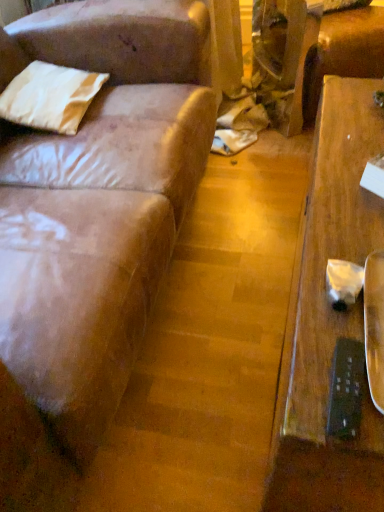
Question: Should I look upward or downward to see white cotton pillow at upper left?

Choices:
 (A) down
 (B) up

Answer: (B)